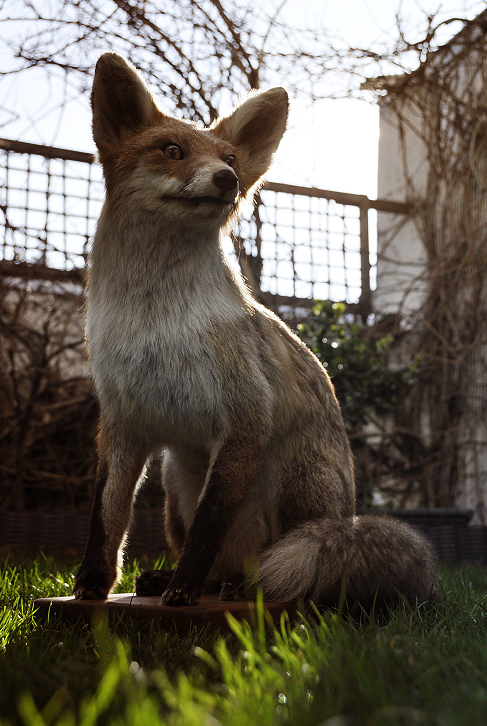
Where is `taxidermy fox statue`? This screenshot has width=487, height=726. taxidermy fox statue is located at coordinates click(x=175, y=274).